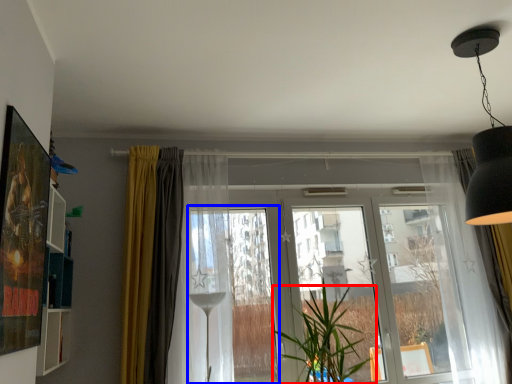
Question: Which of the following is the closest to the observer, houseplant (highlighted by a red box) or window frame (highlighted by a blue box)?

Choices:
 (A) houseplant
 (B) window frame

Answer: (A)